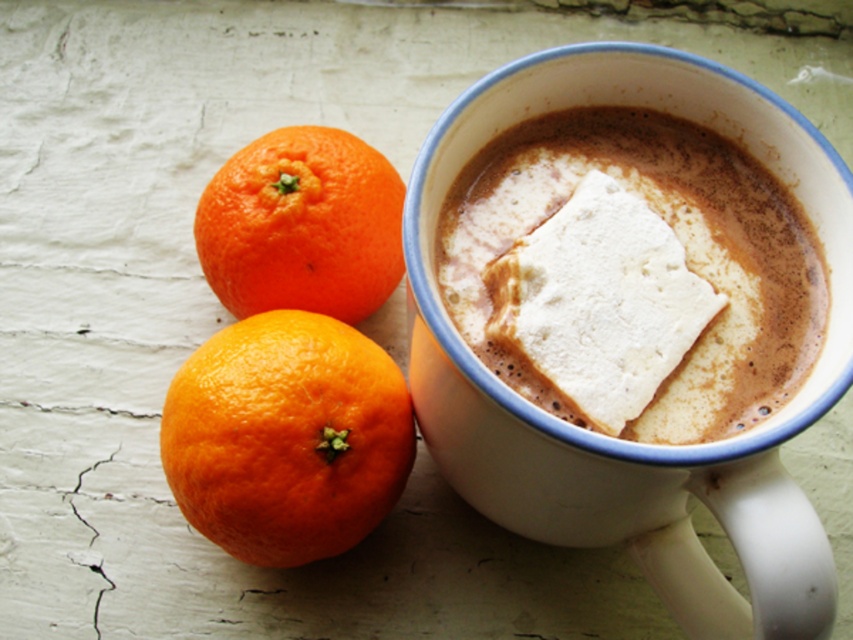
From the picture: You are arranging fruits on a table and have two oranges labeled orangesmoothfruit at left and orangesmoothorange at left. Which one is more to the left?

The orangesmoothorange at left is more to the left because the orangesmoothfruit at left is positioned on the right side of it.

You are a customer at a cafe and want to place a small spoon at the point marked by coordinates point (677, 240). Based on the scene description, where will the spoon land?

The spoon will land on the white fluffy marshmallow in the cup at center because the coordinates point (677, 240) is on it.

You are arranging fruits and desserts on a table. You have a white fluffy marshmallow in the cup at center and an orangesmoothorange at left. According to the image, which item is positioned to the right side of the other?

The white fluffy marshmallow in the cup at center is positioned to the right of orangesmoothorange at left.